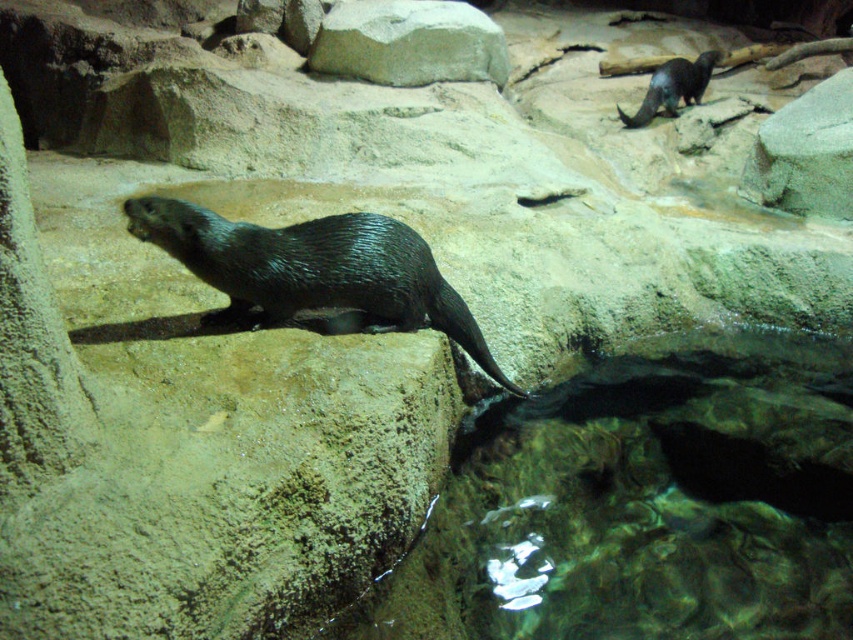
You are a zookeeper observing the otter enclosure. You need to place a new feeding station in the enclosure. The feeding station requires a flat surface that can support its weight. Based on the scene, which object between the gray stone boulder at upper center and the shiny black beaver at upper right would be more suitable for placing the feeding station?

The gray stone boulder at upper center is larger and thus more stable, making it a better choice for placing the feeding station compared to the shiny black beaver at upper right.